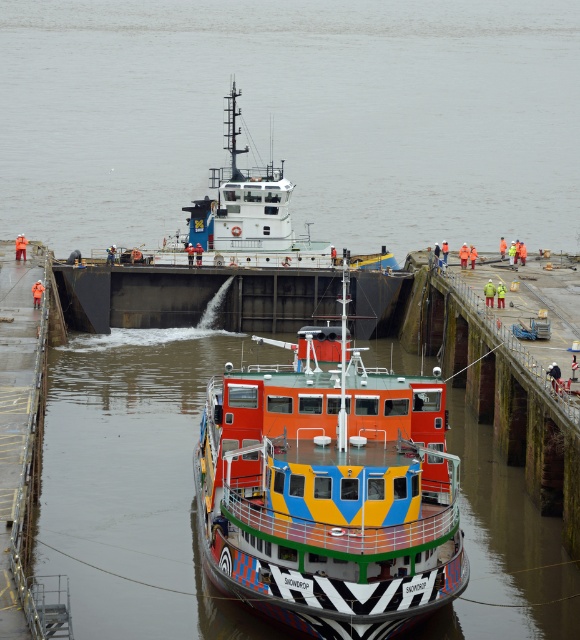
Question: Which of the following is the farthest from the observer?

Choices:
 (A) multicolored painted ship at center
 (B) white glossy tugboat at center

Answer: (B)

Question: Can you confirm if multicolored painted ship at center is wider than white glossy tugboat at center?

Choices:
 (A) no
 (B) yes

Answer: (A)

Question: Which point is closer to the camera taking this photo?

Choices:
 (A) (378, 257)
 (B) (277, 342)

Answer: (B)

Question: Is multicolored painted ship at center to the left of white glossy tugboat at center from the viewer's perspective?

Choices:
 (A) yes
 (B) no

Answer: (B)

Question: Observing the image, what is the correct spatial positioning of multicolored painted ship at center in reference to white glossy tugboat at center?

Choices:
 (A) below
 (B) above

Answer: (A)